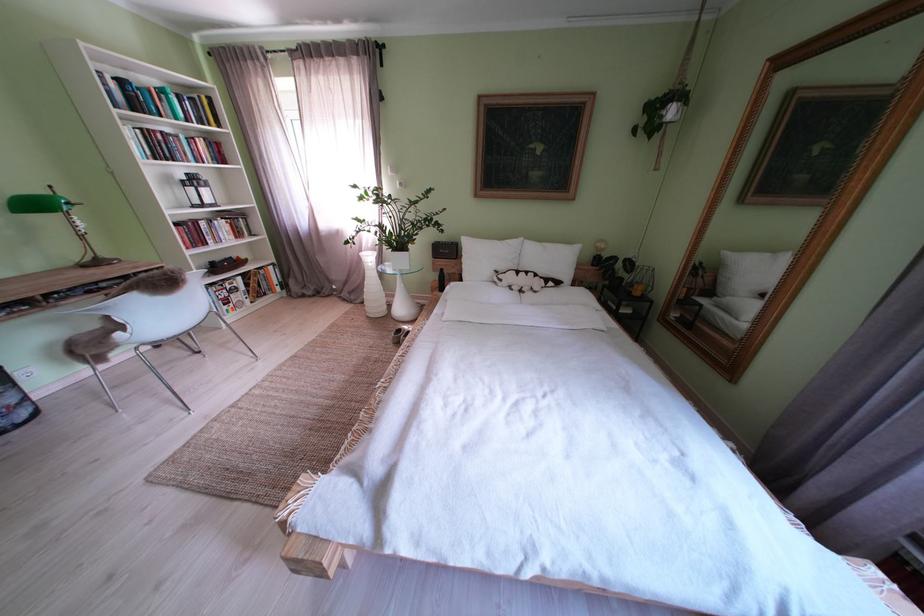
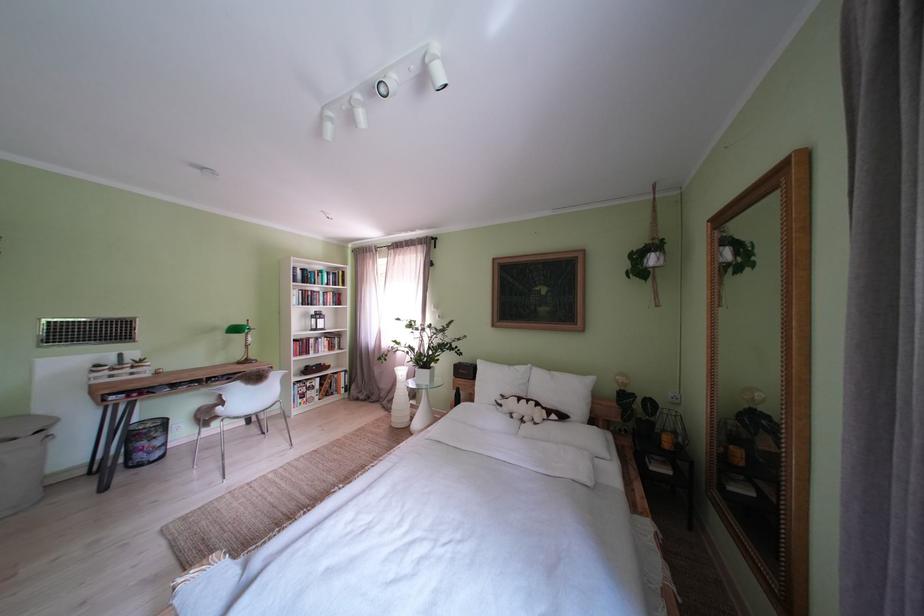
The images are taken continuously from a first-person perspective. In which direction is your viewpoint rotating?

The rotation direction of the camera is left-up.